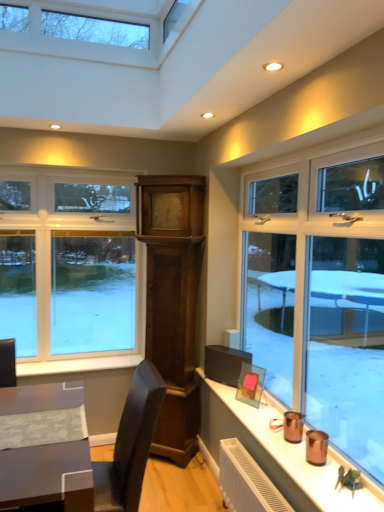
Question: Is white wood window sill at lower left wider or thinner than clear glass window at left?

Choices:
 (A) wide
 (B) thin

Answer: (A)

Question: Considering the positions of white wood window sill at lower left and clear glass window at left in the image, is white wood window sill at lower left taller or shorter than clear glass window at left?

Choices:
 (A) short
 (B) tall

Answer: (A)

Question: Is point (119, 368) closer or farther from the camera than point (134, 359)?

Choices:
 (A) closer
 (B) farther

Answer: (A)

Question: Does point (135, 344) appear closer or farther from the camera than point (104, 359)?

Choices:
 (A) farther
 (B) closer

Answer: (A)

Question: Considering the positions of clear glass window at left and white wood window sill at lower left in the image, is clear glass window at left bigger or smaller than white wood window sill at lower left?

Choices:
 (A) big
 (B) small

Answer: (A)

Question: Is clear glass window at left spatially inside white wood window sill at lower left, or outside of it?

Choices:
 (A) inside
 (B) outside

Answer: (B)

Question: From a real-world perspective, is clear glass window at left above or below white wood window sill at lower left?

Choices:
 (A) above
 (B) below

Answer: (A)